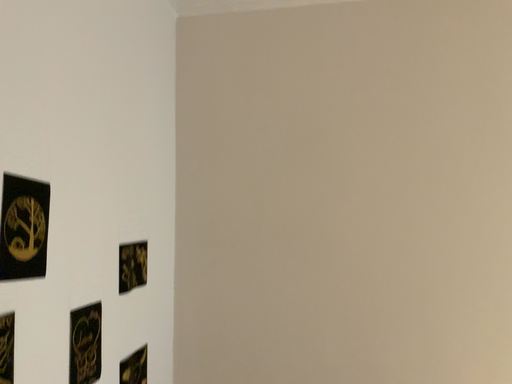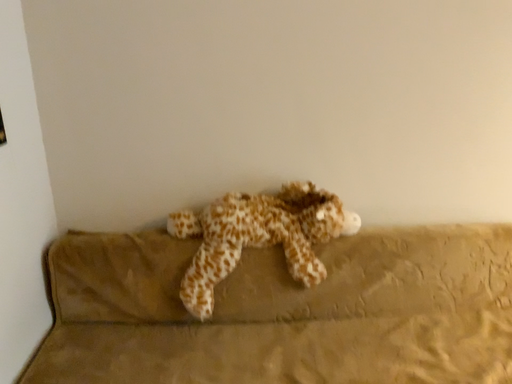
Question: Which way did the camera rotate in the video?

Choices:
 (A) rotated left
 (B) rotated right

Answer: (B)